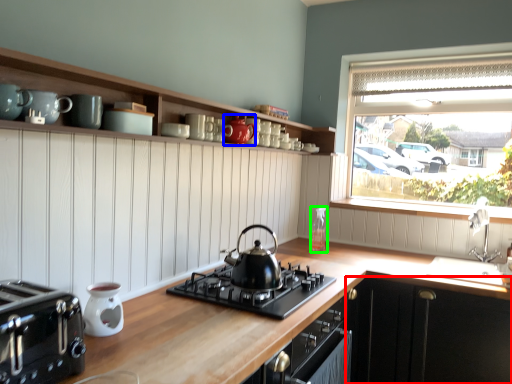
Question: Which object is the farthest from cabinetry (highlighted by a red box)? Choose among these: tea pot (highlighted by a blue box) or bottle (highlighted by a green box).

Choices:
 (A) tea pot
 (B) bottle

Answer: (A)